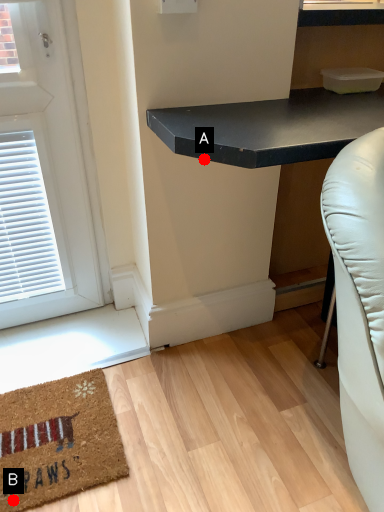
Question: Two points are circled on the image, labeled by A and B beside each circle. Which point is closer to the camera?

Choices:
 (A) A is closer
 (B) B is closer

Answer: (A)